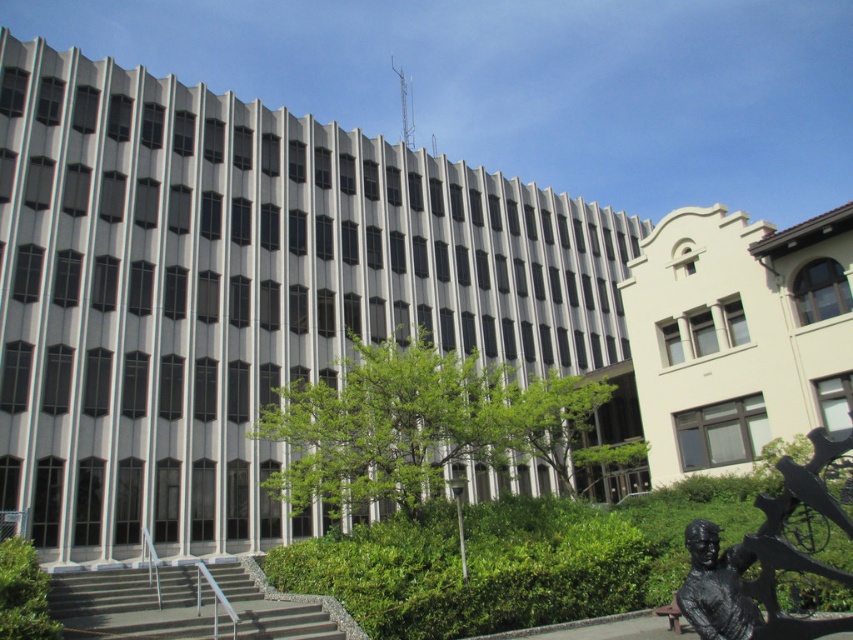
Question: Does gray concrete stairs at lower left have a smaller size compared to black polished statue at lower right?

Choices:
 (A) no
 (B) yes

Answer: (A)

Question: Which object is farther from the camera taking this photo?

Choices:
 (A) black polished statue at lower right
 (B) black bronze statue at lower right
 (C) gray concrete stairs at lower left

Answer: (C)

Question: Is gray concrete stairs at lower left wider than black polished statue at lower right?

Choices:
 (A) yes
 (B) no

Answer: (A)

Question: Which of these objects is positioned farthest from the black bronze statue at lower right?

Choices:
 (A) gray concrete stairs at lower left
 (B) black polished statue at lower right

Answer: (A)

Question: Can you confirm if black bronze statue at lower right is bigger than gray concrete stairs at lower left?

Choices:
 (A) yes
 (B) no

Answer: (B)

Question: Which point is farther from the camera taking this photo?

Choices:
 (A) (788, 624)
 (B) (59, 609)

Answer: (B)